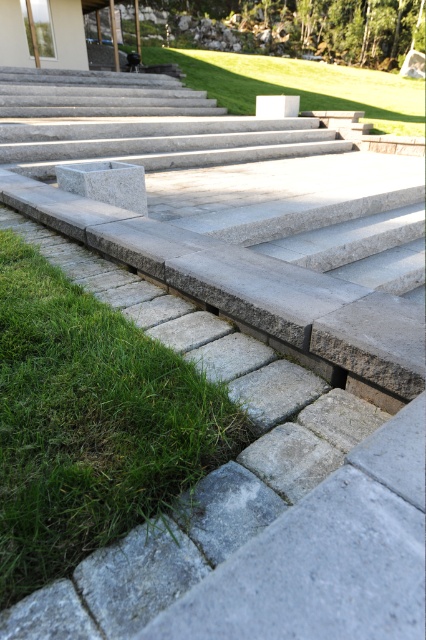
Question: Is green grass at lower left to the right of green grass at center from the viewer's perspective?

Choices:
 (A) no
 (B) yes

Answer: (A)

Question: Does green grass at lower left appear under green grass at center?

Choices:
 (A) no
 (B) yes

Answer: (B)

Question: Among these objects, which one is farthest from the camera?

Choices:
 (A) green grass at lower left
 (B) green grass at center

Answer: (B)

Question: Which point is closer to the camera?

Choices:
 (A) green grass at center
 (B) green grass at lower left

Answer: (B)

Question: From the image, what is the correct spatial relationship of green grass at lower left in relation to green grass at center?

Choices:
 (A) left
 (B) right

Answer: (A)